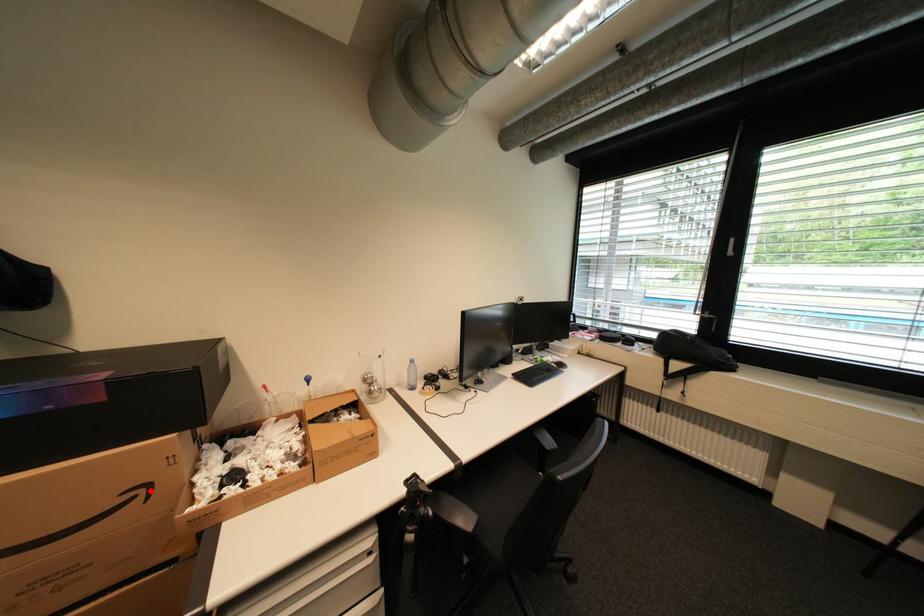
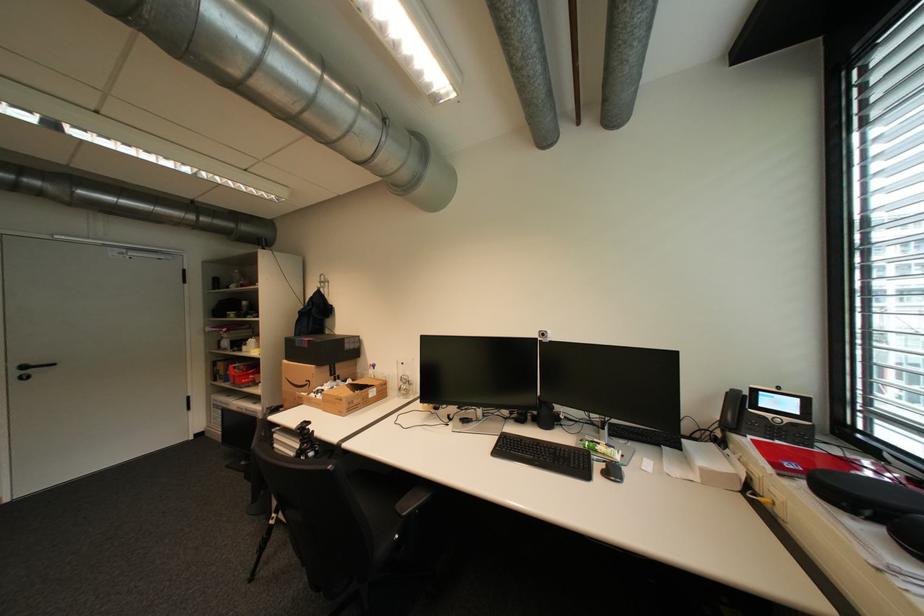
Question: A red point is marked in image1. In image2, is the corresponding 3D point closer to the camera or farther? Reply with the corresponding letter.

Choices:
 (A) The corresponding 3D point is closer.
 (B) The corresponding 3D point is farther.

Answer: (B)